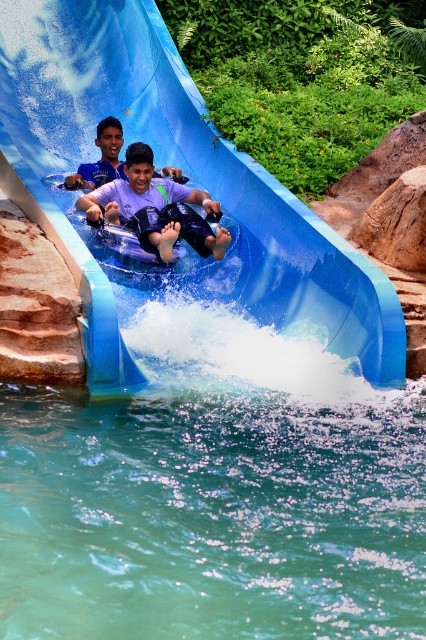
Question: Does blue rubber slide at center have a greater width compared to purple matte life vest at center?

Choices:
 (A) yes
 (B) no

Answer: (A)

Question: Which object is closer to the camera taking this photo?

Choices:
 (A) blue rubber slide at center
 (B) purple matte life vest at center

Answer: (A)

Question: Is blue rubber slide at center smaller than purple matte life vest at center?

Choices:
 (A) no
 (B) yes

Answer: (A)

Question: Which is farther from the matte blue shorts at center?

Choices:
 (A) purple matte life vest at center
 (B) blue rubber slide at center

Answer: (B)

Question: Does blue rubber slide at center have a greater width compared to matte blue shorts at center?

Choices:
 (A) yes
 (B) no

Answer: (A)

Question: Based on their relative distances, which object is farther from the blue rubber slide at center?

Choices:
 (A) matte blue shorts at center
 (B) purple matte life vest at center

Answer: (A)